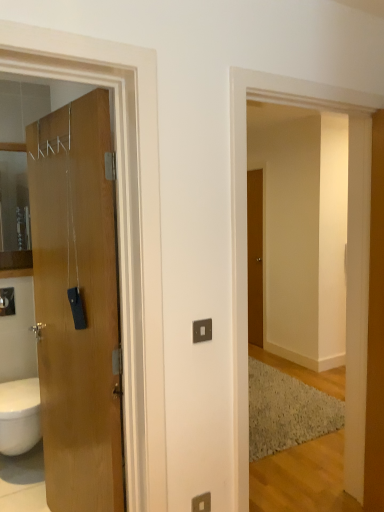
Question: Is point (256, 278) positioned closer to the camera than point (56, 254)?

Choices:
 (A) closer
 (B) farther

Answer: (B)

Question: Do you think brown wooden door at center, the second door positioned from the front, is within wooden door at left, which is the 1th door in front-to-back order, or outside of it?

Choices:
 (A) outside
 (B) inside

Answer: (A)

Question: Which object is the farthest from the brown wooden door at center, which appears as the first door when viewed from the right?

Choices:
 (A) wooden pillar at right
 (B) wooden door at left, the 2th door positioned from the right
 (C) matte silver switch at lower center

Answer: (C)

Question: Based on their relative distances, which object is farther from the wooden door at left, arranged as the 1th door when viewed from the left?

Choices:
 (A) brown wooden door at center, the 2th door from the left
 (B) matte silver switch at lower center
 (C) wooden pillar at right

Answer: (A)